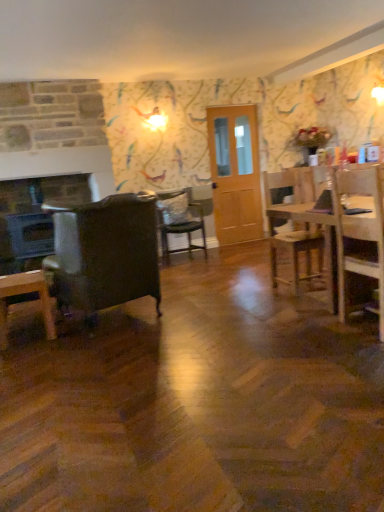
Find the location of `dark brown leather chair at center, the first chair positioned from the front`. dark brown leather chair at center, the first chair positioned from the front is located at coordinates (106, 252).

The height and width of the screenshot is (512, 384). What do you see at coordinates (235, 173) in the screenshot? I see `light brown wooden door at center` at bounding box center [235, 173].

What is the approximate width of matte black fireplace at left?

matte black fireplace at left is 20.99 inches wide.

The width and height of the screenshot is (384, 512). Identify the location of matte black fireplace at left. (33, 217).

The image size is (384, 512). What do you see at coordinates (325, 240) in the screenshot?
I see `wooden table at right` at bounding box center [325, 240].

You are a GUI agent. You are given a task and a screenshot of the screen. Output one action in this format:
    pyautogui.click(x=<x>, y=<y>)
    Task: Click on the velvet cushioned chair at center, the first chair positioned from the back
    The width and height of the screenshot is (384, 512).
    Given the screenshot: What is the action you would take?
    pyautogui.click(x=180, y=220)

Considering the relative positions of dark brown leather chair at center, which is the first chair in left-to-right order, and matte black fireplace at left in the image provided, is dark brown leather chair at center, which is the first chair in left-to-right order, to the left of matte black fireplace at left from the viewer's perspective?

No, dark brown leather chair at center, which is the first chair in left-to-right order, is not to the left of matte black fireplace at left.

Is dark brown leather chair at center, the first chair positioned from the front, oriented towards matte black fireplace at left?

Yes, dark brown leather chair at center, the first chair positioned from the front, is aimed at matte black fireplace at left.

Is matte black fireplace at left a part of dark brown leather chair at center, which is the first chair in left-to-right order?

That's incorrect, matte black fireplace at left is not inside dark brown leather chair at center, which is the first chair in left-to-right order.

Which of these two, dark brown leather chair at center, which ranks as the third chair in right-to-left order, or matte black fireplace at left, is smaller?

Smaller between the two is matte black fireplace at left.

Is velvet cushioned chair at center, the first chair positioned from the back, smaller than light brown wooden door at center?

Incorrect, velvet cushioned chair at center, the first chair positioned from the back, is not smaller in size than light brown wooden door at center.

Considering the sizes of objects velvet cushioned chair at center, the first chair positioned from the back, and light brown wooden door at center in the image provided, who is shorter, velvet cushioned chair at center, the first chair positioned from the back, or light brown wooden door at center?

Standing shorter between the two is velvet cushioned chair at center, the first chair positioned from the back.

Is velvet cushioned chair at center, the first chair positioned from the back, positioned with its back to light brown wooden door at center?

No, velvet cushioned chair at center, the first chair positioned from the back, is not facing the opposite direction of light brown wooden door at center.

Between wooden desk at lower left and dark brown leather chair at center, the first chair positioned from the front, which one has more height?

dark brown leather chair at center, the first chair positioned from the front, is taller.

From the image's perspective, does wooden desk at lower left appear higher than dark brown leather chair at center, which is the first chair in left-to-right order?

No, from the image's perspective, wooden desk at lower left is not over dark brown leather chair at center, which is the first chair in left-to-right order.

Which object is more forward, wooden desk at lower left or dark brown leather chair at center, the 3th chair positioned from the back?

dark brown leather chair at center, the 3th chair positioned from the back, is in front.

Who is smaller, wooden desk at lower left or dark brown leather chair at center, the 3th chair positioned from the back?

wooden desk at lower left.

Can you see wooden desk at lower left touching white soft pillow at center?

No, wooden desk at lower left is not beside white soft pillow at center.

Does wooden desk at lower left have a greater width compared to white soft pillow at center?

Indeed, wooden desk at lower left has a greater width compared to white soft pillow at center.

Where is `desk that appears below the white soft pillow at center (from a real-world perspective)`? Image resolution: width=384 pixels, height=512 pixels. desk that appears below the white soft pillow at center (from a real-world perspective) is located at coordinates (23, 295).

Between wooden desk at lower left and white soft pillow at center, which one has larger size?

Bigger between the two is wooden desk at lower left.

Is light brown wooden door at center wider or thinner than wooden desk at lower left?

light brown wooden door at center is thinner than wooden desk at lower left.

Measure the distance between light brown wooden door at center and wooden desk at lower left.

3.74 meters.

In the image, is light brown wooden door at center on the left side or the right side of wooden desk at lower left?

From the image, it's evident that light brown wooden door at center is to the right of wooden desk at lower left.

Locate an element on the screen. desk below the light brown wooden door at center (from a real-world perspective) is located at coordinates (23, 295).

Does wooden chair at right, positioned as the second chair in front-to-back order, touch light brown wooden door at center?

No, wooden chair at right, positioned as the second chair in front-to-back order, is not in contact with light brown wooden door at center.

From the picture: Between wooden chair at right, the second chair viewed from the back, and light brown wooden door at center, which one has smaller size?

wooden chair at right, the second chair viewed from the back.

Is wooden chair at right, the 1th chair from the right, to the left of light brown wooden door at center from the viewer's perspective?

No, wooden chair at right, the 1th chair from the right, is not to the left of light brown wooden door at center.

Is light brown wooden door at center located within wooden chair at right, positioned as the second chair in front-to-back order?

That's incorrect, light brown wooden door at center is not inside wooden chair at right, positioned as the second chair in front-to-back order.

From the picture: From the image's perspective, does wooden table at right appear lower than black matte laptop at center?

Correct, wooden table at right appears lower than black matte laptop at center in the image.

Which is more distant, (276, 206) or (324, 194)?

The point (276, 206) is farther.

Is the depth of wooden table at right less than that of black matte laptop at center?

Yes, wooden table at right is in front of black matte laptop at center.

Find the location of a particular element. This screenshot has height=512, width=384. kitchen & dining room table on the right side of black matte laptop at center is located at coordinates (325, 240).

Image resolution: width=384 pixels, height=512 pixels. Identify the location of fireplace above the dark brown leather chair at center, the 3th chair positioned from the back (from the image's perspective). (33, 217).

There is a light brown wooden door at center. Find the location of `the 1st chair below it (from the image's perspective)`. the 1st chair below it (from the image's perspective) is located at coordinates (180, 220).

From the image, which object appears to be farther from wooden table at right, matte black fireplace at left or white soft pillow at center?

matte black fireplace at left lies further to wooden table at right than the other object.

From the image, which object appears to be farther from wooden chair at right, positioned as the 3th chair in left-to-right order, black matte laptop at center or white soft pillow at center?

white soft pillow at center is further to wooden chair at right, positioned as the 3th chair in left-to-right order.

Estimate the real-world distances between objects in this image. Which object is closer to black matte laptop at center, wooden chair at right, the 1th chair from the right, or wooden desk at lower left?

Among the two, wooden chair at right, the 1th chair from the right, is located nearer to black matte laptop at center.

When comparing their distances from velvet cushioned chair at center, the 2th chair from the right, does wooden desk at lower left or wooden chair at right, the 1th chair from the right, seem further?

Among the two, wooden desk at lower left is located further to velvet cushioned chair at center, the 2th chair from the right.

Considering their positions, is wooden desk at lower left positioned further to dark brown leather chair at center, which ranks as the third chair in right-to-left order, than light brown wooden door at center?

Among the two, light brown wooden door at center is located further to dark brown leather chair at center, which ranks as the third chair in right-to-left order.

When comparing their distances from wooden desk at lower left, does wooden table at right or wooden chair at right, positioned as the second chair in front-to-back order, seem closer?

wooden table at right is closer to wooden desk at lower left.

Looking at the image, which one is located closer to wooden chair at right, the 1th chair from the right, wooden desk at lower left or dark brown leather chair at center, the first chair positioned from the front?

Among the two, dark brown leather chair at center, the first chair positioned from the front, is located nearer to wooden chair at right, the 1th chair from the right.

Looking at the image, which one is located further to black matte laptop at center, wooden chair at right, the 1th chair from the right, or light brown wooden door at center?

light brown wooden door at center.

You are a GUI agent. You are given a task and a screenshot of the screen. Output one action in this format:
    pyautogui.click(x=<x>, y=<y>)
    Task: Click on the chair positioned between dark brown leather chair at center, the 3th chair positioned from the back, and velvet cushioned chair at center, the first chair positioned from the back, from near to far
    Image resolution: width=384 pixels, height=512 pixels.
    Given the screenshot: What is the action you would take?
    pyautogui.click(x=296, y=251)

Locate an element on the screen. fireplace positioned between wooden desk at lower left and light brown wooden door at center from near to far is located at coordinates (33, 217).

This screenshot has width=384, height=512. Identify the location of laptop between dark brown leather chair at center, which is the first chair in left-to-right order, and light brown wooden door at center in the front-back direction. (324, 202).

This screenshot has width=384, height=512. I want to click on pillow between matte black fireplace at left and black matte laptop at center, so click(174, 209).